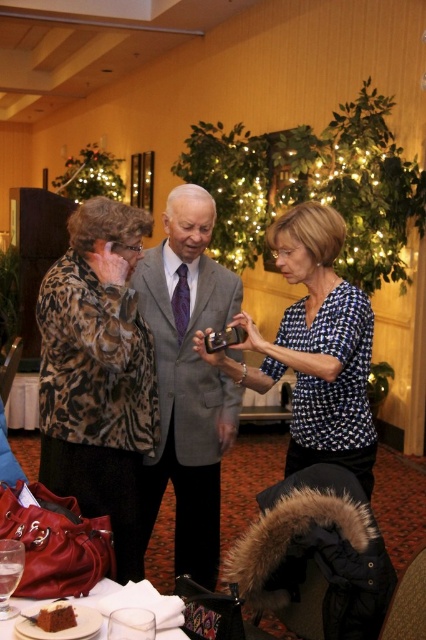
You are at a formal event and need to decide which outfit is more narrow between the gray suit at center and the blue dotted blouse at center. Which one should you choose?

The gray suit at center is thinner than the blue dotted blouse at center, so you should choose the gray suit at center as it is more narrow.

You are at a formal event and want to greet both the person wearing the leopard print jacket at left and the person in the blue dotted blouse at center. Which person should you approach first if you are standing to the right of both individuals?

You should approach the leopard print jacket at left first because it is to the left of the blue dotted blouse at center, so it is closer to you when standing to the right of both.